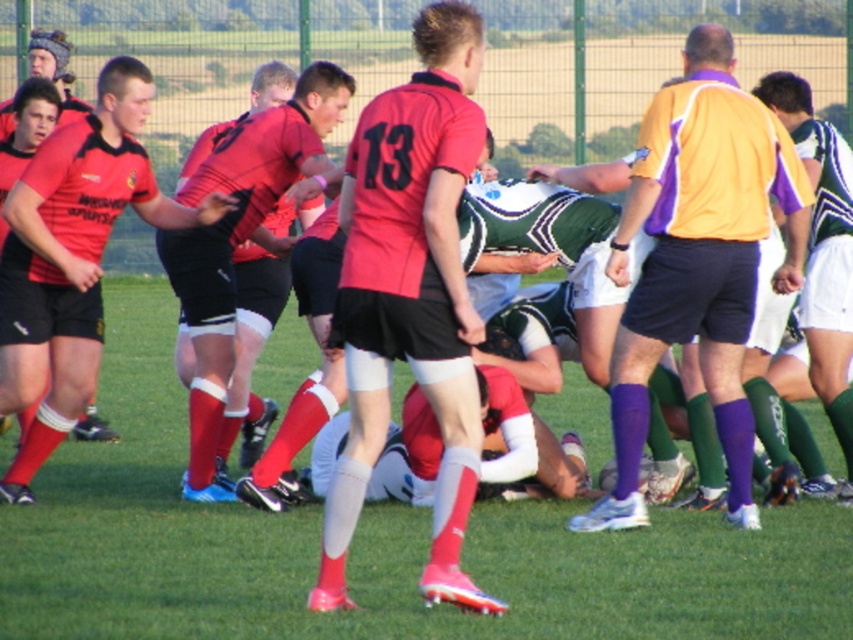
The image size is (853, 640). In order to click on matte red jersey at center in this screenshot , I will do point(410,294).

Does matte red jersey at center have a greater height compared to matte red socks at center?

Yes, matte red jersey at center is taller than matte red socks at center.

Is point (480, 593) farther from camera compared to point (218, 378)?

No, (480, 593) is in front of (218, 378).

Where is `matte red jersey at center`? The height and width of the screenshot is (640, 853). matte red jersey at center is located at coordinates (410, 294).

What do you see at coordinates (410, 294) in the screenshot? I see `matte red jersey at center` at bounding box center [410, 294].

Between point (345, 372) and point (634, 332), which one is positioned behind?

The point (345, 372) is behind.

Between point (396, 314) and point (618, 236), which one is positioned behind?

Positioned behind is point (618, 236).

Find the location of a particular element. This screenshot has width=853, height=640. matte red jersey at center is located at coordinates (410, 294).

Is orange and purple jersey at center taller than green striped jersey at center?

Correct, orange and purple jersey at center is much taller as green striped jersey at center.

Is orange and purple jersey at center smaller than green striped jersey at center?

Actually, orange and purple jersey at center might be larger than green striped jersey at center.

Is point (670, 109) positioned behind point (846, 266)?

That is False.

The image size is (853, 640). What are the coordinates of `orange and purple jersey at center` in the screenshot? It's located at (698, 260).